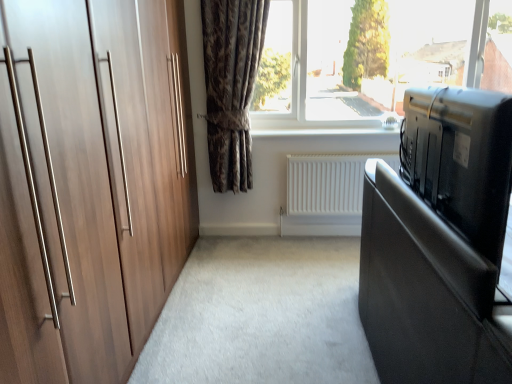
Question: From a real-world perspective, is white matte radiator at center under black glossy tv at right?

Choices:
 (A) yes
 (B) no

Answer: (A)

Question: Is white matte radiator at center aimed at black glossy tv at right?

Choices:
 (A) yes
 (B) no

Answer: (A)

Question: Can you confirm if white matte radiator at center is positioned to the right of black glossy tv at right?

Choices:
 (A) no
 (B) yes

Answer: (A)

Question: Are white matte radiator at center and black glossy tv at right located far from each other?

Choices:
 (A) yes
 (B) no

Answer: (A)

Question: Is the position of white matte radiator at center more distant than that of black glossy tv at right?

Choices:
 (A) no
 (B) yes

Answer: (B)

Question: Considering the relative sizes of white matte radiator at center and black glossy tv at right in the image provided, is white matte radiator at center taller than black glossy tv at right?

Choices:
 (A) yes
 (B) no

Answer: (B)

Question: Is smooth black bed at right not near black glossy tv at right?

Choices:
 (A) no
 (B) yes

Answer: (A)

Question: From a real-world perspective, is smooth black bed at right over black glossy tv at right?

Choices:
 (A) no
 (B) yes

Answer: (A)

Question: Can you confirm if smooth black bed at right is bigger than black glossy tv at right?

Choices:
 (A) no
 (B) yes

Answer: (A)

Question: Is smooth black bed at right smaller than black glossy tv at right?

Choices:
 (A) yes
 (B) no

Answer: (A)

Question: Is smooth black bed at right aimed at black glossy tv at right?

Choices:
 (A) yes
 (B) no

Answer: (B)

Question: From the image's perspective, is smooth black bed at right on top of black glossy tv at right?

Choices:
 (A) yes
 (B) no

Answer: (B)

Question: Is dark brown textured curtain at center smaller than black glossy tv at right?

Choices:
 (A) yes
 (B) no

Answer: (A)